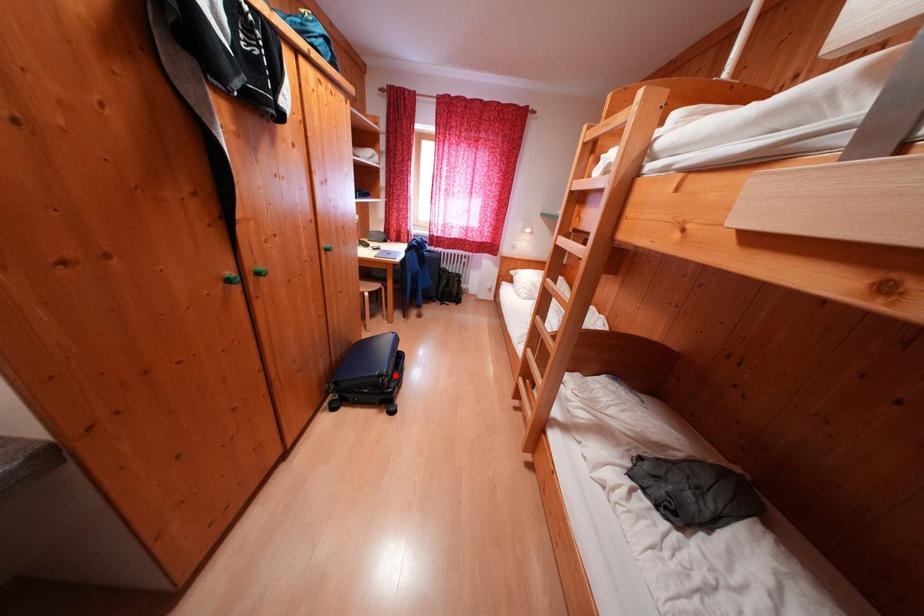
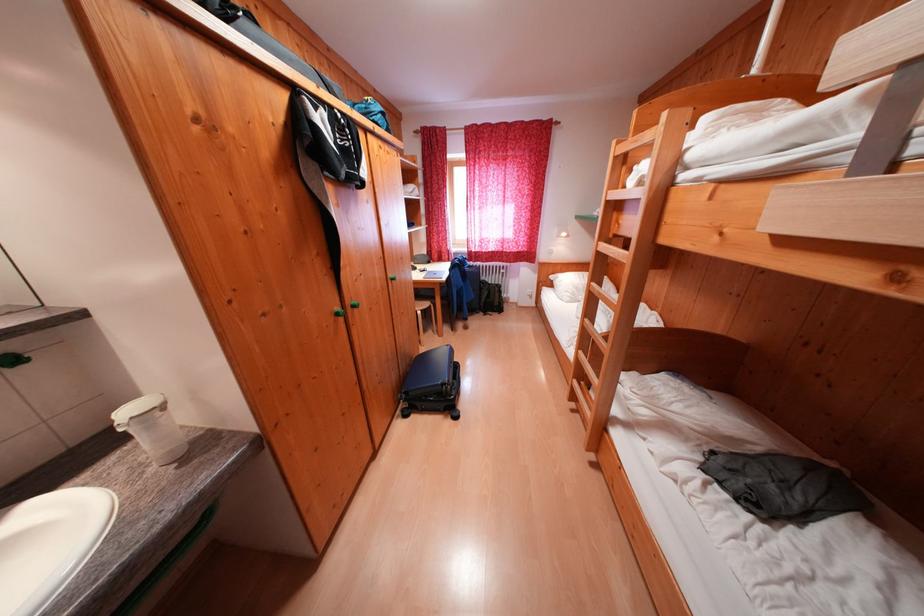
Locate, in the second image, the point that corresponds to the highlighted location in the first image.

(456, 384)